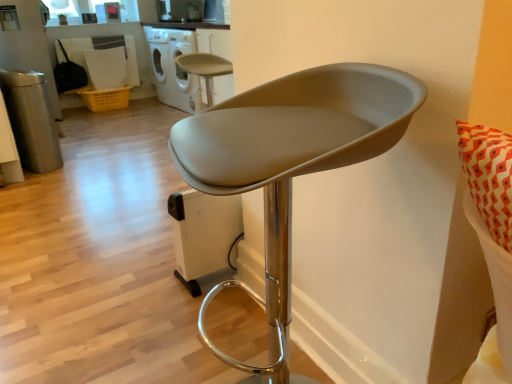
Question: Considering the relative sizes of matte gray stool at center, the 1th chair from the front, and matte gray stool at center, which is the 1th chair in top-to-bottom order, in the image provided, is matte gray stool at center, the 1th chair from the front, wider than matte gray stool at center, which is the 1th chair in top-to-bottom order,?

Choices:
 (A) no
 (B) yes

Answer: (A)

Question: Does matte gray stool at center, which is the 2th chair in left-to-right order, appear on the right side of matte gray stool at center, which is counted as the 2th chair, starting from the bottom?

Choices:
 (A) yes
 (B) no

Answer: (A)

Question: Can you confirm if matte gray stool at center, which is the 2th chair from top to bottom, is taller than matte gray stool at center, which is the first chair from back to front?

Choices:
 (A) no
 (B) yes

Answer: (B)

Question: Is matte gray stool at center, the second chair from the back, further to camera compared to matte gray stool at center, placed as the 2th chair when sorted from right to left?

Choices:
 (A) no
 (B) yes

Answer: (A)

Question: Does matte gray stool at center, the second chair from the back, have a larger size compared to matte gray stool at center, which is the 1th chair in top-to-bottom order?

Choices:
 (A) yes
 (B) no

Answer: (A)

Question: Considering the positions of matte gray stool at center, which is the 2th chair in left-to-right order, and matte gray stool at center, placed as the 2th chair when sorted from right to left, in the image, is matte gray stool at center, which is the 2th chair in left-to-right order, bigger or smaller than matte gray stool at center, placed as the 2th chair when sorted from right to left,?

Choices:
 (A) big
 (B) small

Answer: (A)

Question: Visually, is matte gray stool at center, placed as the 1th chair when sorted from right to left, positioned to the left or to the right of matte gray stool at center, which is the 1th chair in top-to-bottom order?

Choices:
 (A) left
 (B) right

Answer: (B)

Question: Relative to matte gray stool at center, which is the first chair from back to front, is matte gray stool at center, which is the 2th chair in left-to-right order, in front or behind?

Choices:
 (A) behind
 (B) front

Answer: (B)

Question: From the image's perspective, relative to matte gray stool at center, which is the 1th chair in top-to-bottom order, is matte gray stool at center, the 1th chair from the front, above or below?

Choices:
 (A) below
 (B) above

Answer: (A)

Question: Is white glossy dishwasher at upper center wider or thinner than matte gray stool at center, which is the 2th chair in left-to-right order?

Choices:
 (A) wide
 (B) thin

Answer: (A)

Question: Is white glossy dishwasher at upper center spatially inside matte gray stool at center, the 1th chair from the front, or outside of it?

Choices:
 (A) outside
 (B) inside

Answer: (A)

Question: From a real-world perspective, is white glossy dishwasher at upper center positioned above or below matte gray stool at center, the 1th chair when ordered from bottom to top?

Choices:
 (A) below
 (B) above

Answer: (B)

Question: From the image's perspective, is white glossy dishwasher at upper center located above or below matte gray stool at center, which is the 2th chair in left-to-right order?

Choices:
 (A) below
 (B) above

Answer: (B)

Question: Does point (193, 62) appear closer or farther from the camera than point (399, 115)?

Choices:
 (A) closer
 (B) farther

Answer: (B)

Question: From a real-world perspective, relative to matte gray stool at center, which is the 2th chair in left-to-right order, is matte gray stool at center, which is counted as the 2th chair, starting from the bottom, vertically above or below?

Choices:
 (A) above
 (B) below

Answer: (B)